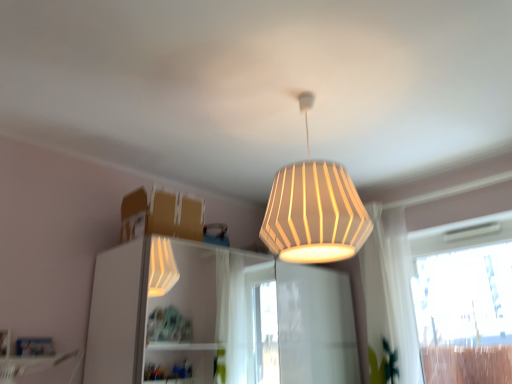
Question: Is white ribbed lampshade at upper center aimed at white sheer curtain at right?

Choices:
 (A) yes
 (B) no

Answer: (B)

Question: Does white ribbed lampshade at upper center have a smaller size compared to white sheer curtain at right?

Choices:
 (A) no
 (B) yes

Answer: (A)

Question: Would you say white ribbed lampshade at upper center is a long distance from white sheer curtain at right?

Choices:
 (A) no
 (B) yes

Answer: (B)

Question: Is white ribbed lampshade at upper center facing away from white sheer curtain at right?

Choices:
 (A) no
 (B) yes

Answer: (B)

Question: From the image's perspective, is white ribbed lampshade at upper center below white sheer curtain at right?

Choices:
 (A) yes
 (B) no

Answer: (B)

Question: Based on their positions, is white glossy dresser at center located to the left or right of white sheer curtain at right?

Choices:
 (A) right
 (B) left

Answer: (B)

Question: Is white glossy dresser at center inside the boundaries of white sheer curtain at right, or outside?

Choices:
 (A) outside
 (B) inside

Answer: (A)

Question: Looking at the image, does white glossy dresser at center seem bigger or smaller compared to white sheer curtain at right?

Choices:
 (A) big
 (B) small

Answer: (A)

Question: In terms of width, does white glossy dresser at center look wider or thinner when compared to white sheer curtain at right?

Choices:
 (A) thin
 (B) wide

Answer: (B)

Question: Is white ribbed lampshade at upper center to the left or to the right of white sheer curtain at right in the image?

Choices:
 (A) right
 (B) left

Answer: (B)

Question: Considering the positions of white ribbed lampshade at upper center and white sheer curtain at right in the image, is white ribbed lampshade at upper center taller or shorter than white sheer curtain at right?

Choices:
 (A) tall
 (B) short

Answer: (B)

Question: From a real-world perspective, relative to white sheer curtain at right, is white ribbed lampshade at upper center vertically above or below?

Choices:
 (A) below
 (B) above

Answer: (B)

Question: Is white ribbed lampshade at upper center inside the boundaries of white sheer curtain at right, or outside?

Choices:
 (A) outside
 (B) inside

Answer: (A)

Question: Is white sheer curtain at right situated inside white ribbed lampshade at upper center or outside?

Choices:
 (A) inside
 (B) outside

Answer: (B)

Question: From a real-world perspective, relative to white ribbed lampshade at upper center, is white sheer curtain at right vertically above or below?

Choices:
 (A) above
 (B) below

Answer: (B)